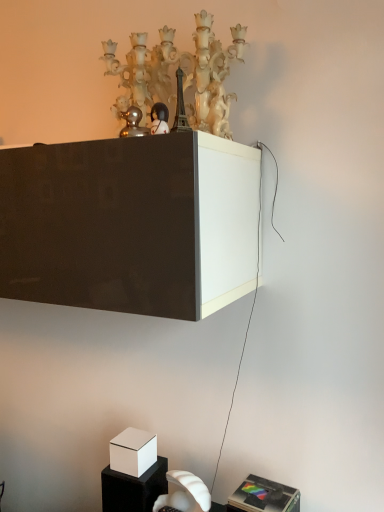
Question: From the image's perspective, is white matte box at lower left positioned above or below matte white chandelier at upper center?

Choices:
 (A) above
 (B) below

Answer: (B)

Question: From a real-world perspective, is white matte box at lower left physically located above or below matte white chandelier at upper center?

Choices:
 (A) above
 (B) below

Answer: (B)

Question: Estimate the real-world distances between objects in this image. Which object is closer to the white matte box at lower left?

Choices:
 (A) metallic silver speaker at lower right, positioned as the 1th furniture in right-to-left order
 (B) white matte cube at lower left, which is counted as the first furniture, starting from the back
 (C) matte white chandelier at upper center
 (D) matte black figurine at upper center

Answer: (B)

Question: Which of these objects is positioned closest to the metallic silver speaker at lower right, which appears as the second furniture when viewed from the left?

Choices:
 (A) white matte cube at lower left, the second furniture when ordered from right to left
 (B) white matte box at lower left
 (C) matte black figurine at upper center
 (D) matte white chandelier at upper center

Answer: (A)